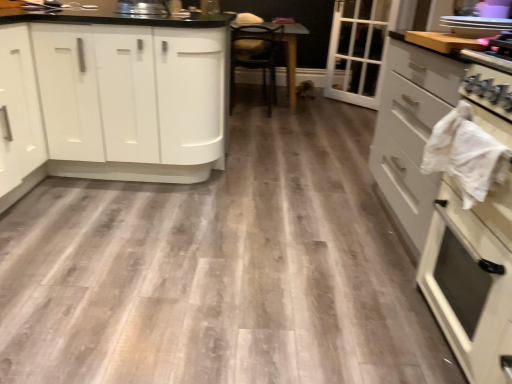
Question: Can you confirm if white glass door at upper right is taller than white glossy cabinets at left, the first cabinetry in the top-to-bottom sequence?

Choices:
 (A) no
 (B) yes

Answer: (B)

Question: Is white glass door at upper right outside white glossy cabinets at left, the first cabinetry from the back?

Choices:
 (A) yes
 (B) no

Answer: (A)

Question: Does white glass door at upper right have a greater width compared to white glossy cabinets at left, which is the second cabinetry in front-to-back order?

Choices:
 (A) yes
 (B) no

Answer: (B)

Question: Is there a large distance between white glass door at upper right and white glossy cabinets at left, which ranks as the 2th cabinetry in right-to-left order?

Choices:
 (A) yes
 (B) no

Answer: (A)

Question: Is white glass door at upper right smaller than white glossy cabinets at left, the first cabinetry in the top-to-bottom sequence?

Choices:
 (A) no
 (B) yes

Answer: (B)

Question: From a real-world perspective, is white glass door at upper right physically above white glossy cabinets at left, which ranks as the 2th cabinetry in right-to-left order?

Choices:
 (A) yes
 (B) no

Answer: (A)

Question: From the image's perspective, does white glossy oven at right, acting as the 2th cabinetry starting from the left, appear lower than white glass door at upper right?

Choices:
 (A) no
 (B) yes

Answer: (B)

Question: Considering the relative positions of white glossy oven at right, the 1th cabinetry when ordered from right to left, and white glass door at upper right in the image provided, is white glossy oven at right, the 1th cabinetry when ordered from right to left, to the right of white glass door at upper right from the viewer's perspective?

Choices:
 (A) yes
 (B) no

Answer: (B)

Question: Can you confirm if white glossy oven at right, acting as the 2th cabinetry starting from the left, is wider than white glass door at upper right?

Choices:
 (A) yes
 (B) no

Answer: (A)

Question: Is white glossy oven at right, which is the first cabinetry from bottom to top, smaller than white glass door at upper right?

Choices:
 (A) no
 (B) yes

Answer: (A)

Question: Can you confirm if white glossy oven at right, which is counted as the second cabinetry, starting from the top, is shorter than white glass door at upper right?

Choices:
 (A) no
 (B) yes

Answer: (B)

Question: Considering the relative sizes of white glossy oven at right, the 1th cabinetry when ordered from right to left, and white glass door at upper right in the image provided, is white glossy oven at right, the 1th cabinetry when ordered from right to left, bigger than white glass door at upper right?

Choices:
 (A) no
 (B) yes

Answer: (B)

Question: Does wooden table at center have a greater width compared to white glass door at upper right?

Choices:
 (A) yes
 (B) no

Answer: (A)